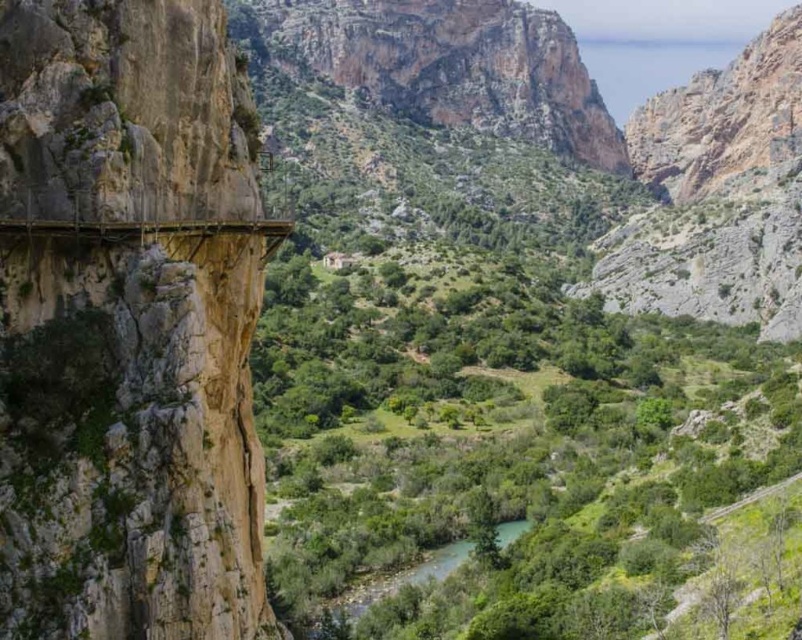
Question: Is rough stone bridge at left positioned in front of green smooth river at center?

Choices:
 (A) no
 (B) yes

Answer: (B)

Question: Among these points, which one is nearest to the camera?

Choices:
 (A) (359, 604)
 (B) (258, 147)

Answer: (B)

Question: Which point appears closest to the camera in this image?

Choices:
 (A) (432, 577)
 (B) (14, 616)

Answer: (B)

Question: Observing the image, what is the correct spatial positioning of rough stone bridge at left in reference to green smooth river at center?

Choices:
 (A) right
 (B) left

Answer: (B)

Question: Does rough stone bridge at left appear on the right side of green smooth river at center?

Choices:
 (A) yes
 (B) no

Answer: (B)